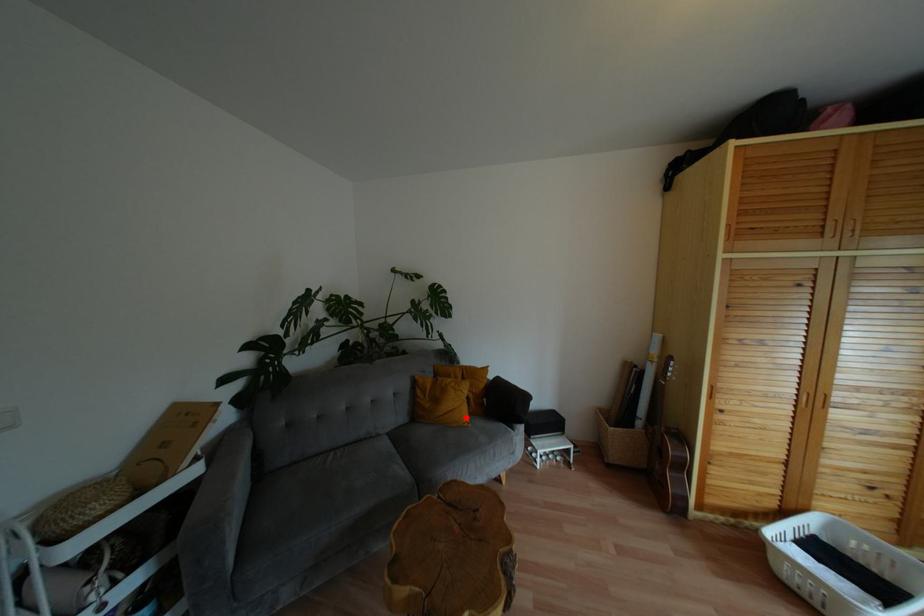
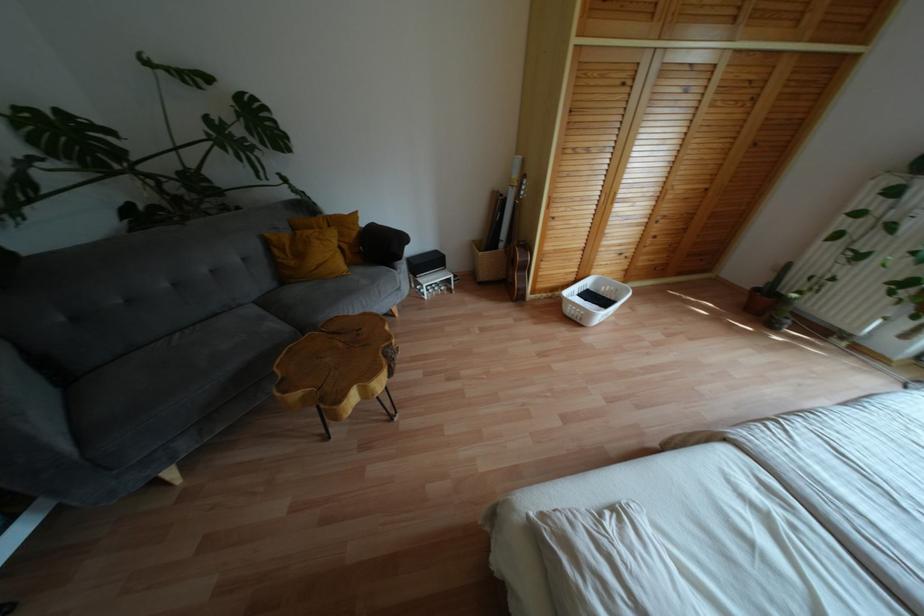
Question: I am providing you with two images of the same scene from different viewpoints. Image1 has a red point marked. In image2, the corresponding 3D location appears at what relative position? Reply with the corresponding letter.

Choices:
 (A) Closer
 (B) Farther

Answer: (A)